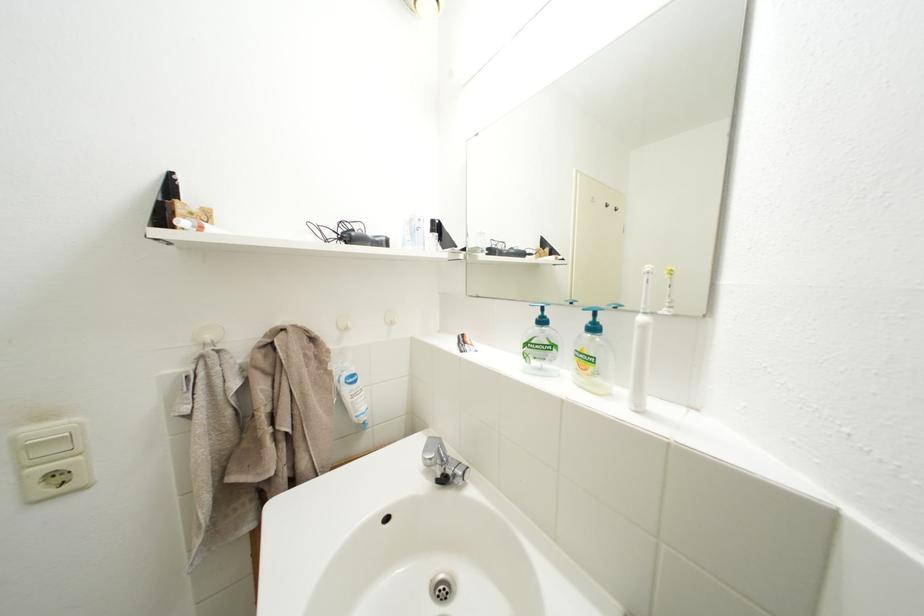
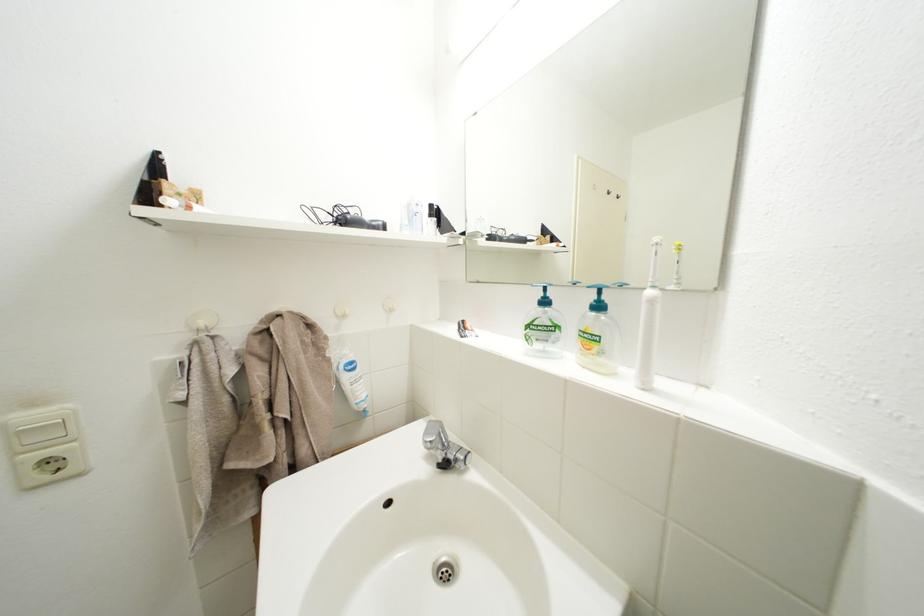
The point at (440, 456) is marked in the first image. Where is the corresponding point in the second image?

(441, 440)